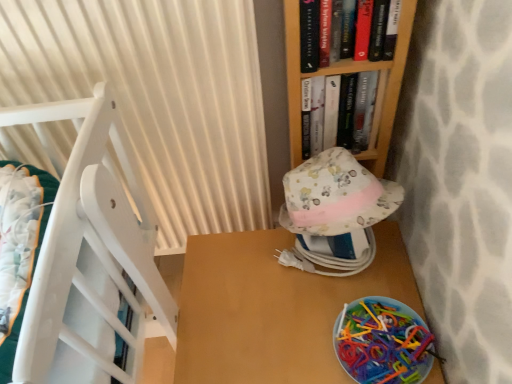
The height and width of the screenshot is (384, 512). What are the coordinates of `free space between floral fabric hat at center and translucent plastic toys at lower right` in the screenshot? It's located at (346, 299).